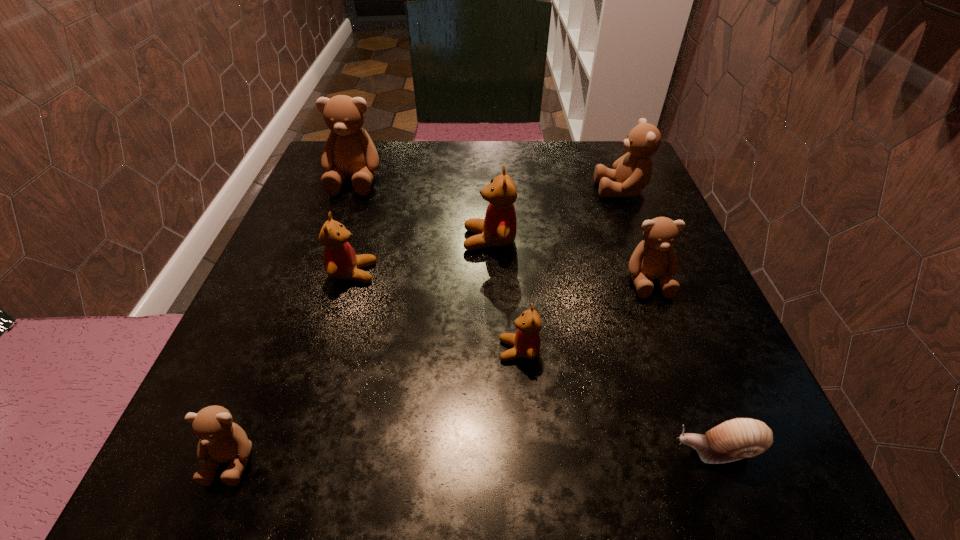
Locate which brown teddy bear is the second closest to the second smallest brown teddy bear. Please provide its 2D coordinates. Your answer should be formatted as a tuple, i.e. [(x, y)], where the tuple contains the x and y coordinates of a point satisfying the conditions above.

[(349, 151)]

Identify which brown teddy bear is the second closest to the biggest red teddy bear. Please provide its 2D coordinates. Your answer should be formatted as a tuple, i.e. [(x, y)], where the tuple contains the x and y coordinates of a point satisfying the conditions above.

[(632, 172)]

Locate an element on the screen. The width and height of the screenshot is (960, 540). red teddy bear that is the closest to the smallest brown teddy bear is located at coordinates (340, 261).

Locate an element on the screen. the second closest red teddy bear to the second biggest brown teddy bear is located at coordinates (526, 341).

You are a GUI agent. You are given a task and a screenshot of the screen. Output one action in this format:
    pyautogui.click(x=<x>, y=<y>)
    Task: Click on the free space that satisfies the following two spatial constraints: 1. on the front-facing side of the second nearest brown teddy bear; 2. on the front-facing side of the sixth farthest teddy bear
    The image size is (960, 540).
    Given the screenshot: What is the action you would take?
    pyautogui.click(x=675, y=350)

This screenshot has width=960, height=540. What are the coordinates of `vacant region that satisfies the following two spatial constraints: 1. on the front-facing side of the second biggest brown teddy bear; 2. on the front-facing side of the third farthest brown teddy bear` in the screenshot? It's located at (658, 281).

The height and width of the screenshot is (540, 960). I want to click on vacant space that satisfies the following two spatial constraints: 1. on the front-facing side of the leftmost red teddy bear; 2. on the front-facing side of the smallest brown teddy bear, so click(300, 459).

Find the location of `vacant space that satisfies the following two spatial constraints: 1. on the front-facing side of the second biggest brown teddy bear; 2. on the front-facing side of the nearest brown teddy bear`. vacant space that satisfies the following two spatial constraints: 1. on the front-facing side of the second biggest brown teddy bear; 2. on the front-facing side of the nearest brown teddy bear is located at coordinates (729, 459).

Find the location of `vacant area in the image that satisfies the following two spatial constraints: 1. on the front-facing side of the biggest red teddy bear; 2. on the front-facing side of the nearest teddy bear`. vacant area in the image that satisfies the following two spatial constraints: 1. on the front-facing side of the biggest red teddy bear; 2. on the front-facing side of the nearest teddy bear is located at coordinates (494, 459).